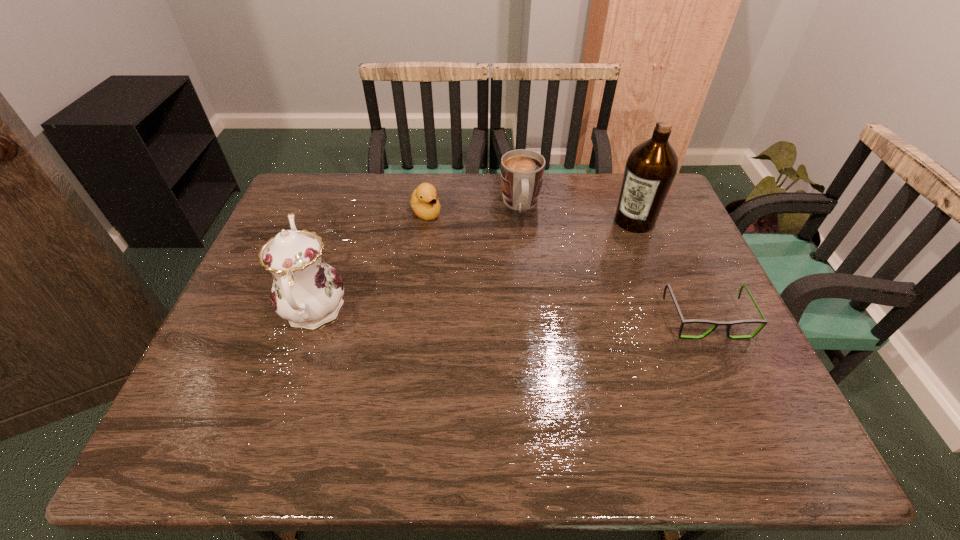
In order to click on free space on the desktop that is between the fourth shortest object and the spectacles and is positioned facing forward on the second object from left to right in this screenshot , I will do `click(509, 315)`.

Where is `free space on the desktop that is between the leftmost object and the spectacles and is positioned on the label of the tallest object`? The width and height of the screenshot is (960, 540). free space on the desktop that is between the leftmost object and the spectacles and is positioned on the label of the tallest object is located at coordinates (552, 315).

At what (x,y) coordinates should I click in order to perform the action: click on free space on the desktop that is between the leftmost object and the spectacles and is positioned on the side of the third shortest object with the handle. Please return your answer as a coordinate pair (x, y). Looking at the image, I should click on (533, 315).